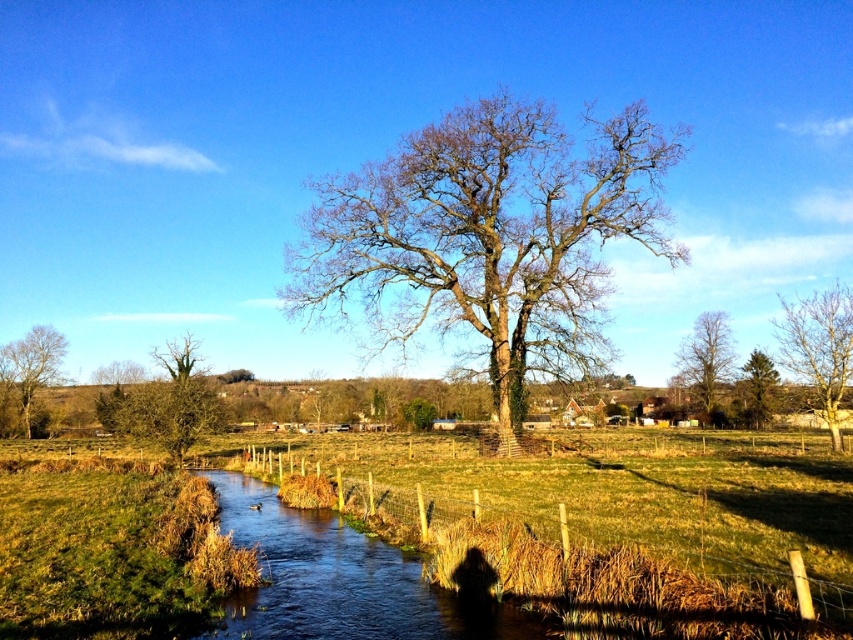
Question: Does bare wood tree at right have a larger size compared to bare wood tree at upper right?

Choices:
 (A) yes
 (B) no

Answer: (A)

Question: Which object appears farthest from the camera in this image?

Choices:
 (A) green textured pine tree at upper right
 (B) bare wood tree at upper right
 (C) bare wood tree at right

Answer: (B)

Question: Which object appears farthest from the camera in this image?

Choices:
 (A) bare wood tree at upper right
 (B) green leafy tree at left
 (C) green textured pine tree at upper right
 (D) wooden post fence at center

Answer: (A)

Question: Observing the image, what is the correct spatial positioning of bare wood tree at upper right in reference to green textured pine tree at upper right?

Choices:
 (A) right
 (B) left

Answer: (B)

Question: Is wooden post fence at center in front of green leafy tree at lower left?

Choices:
 (A) yes
 (B) no

Answer: (A)

Question: Which point is closer to the camera taking this photo?

Choices:
 (A) (711, 385)
 (B) (51, 340)
 (C) (821, 384)
 (D) (163, 442)

Answer: (D)